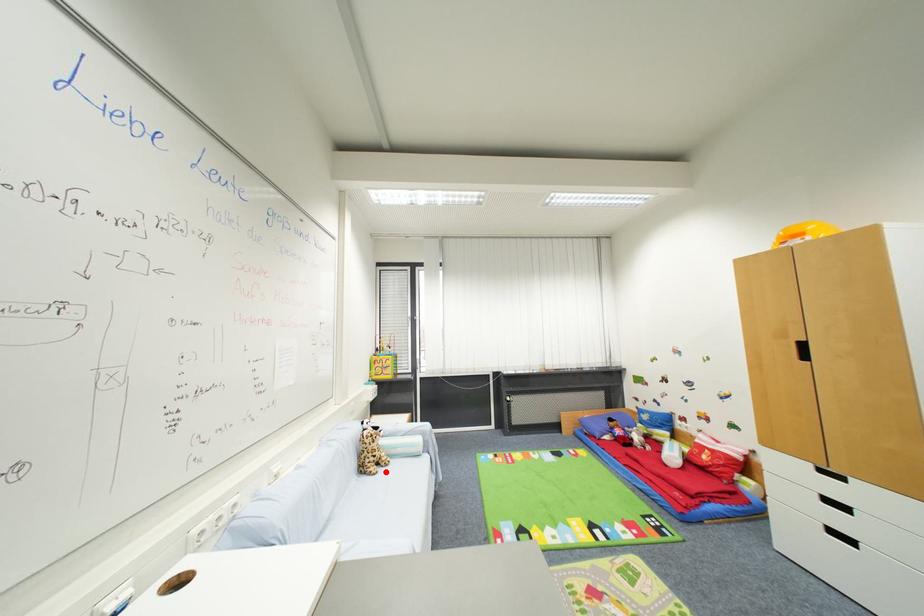
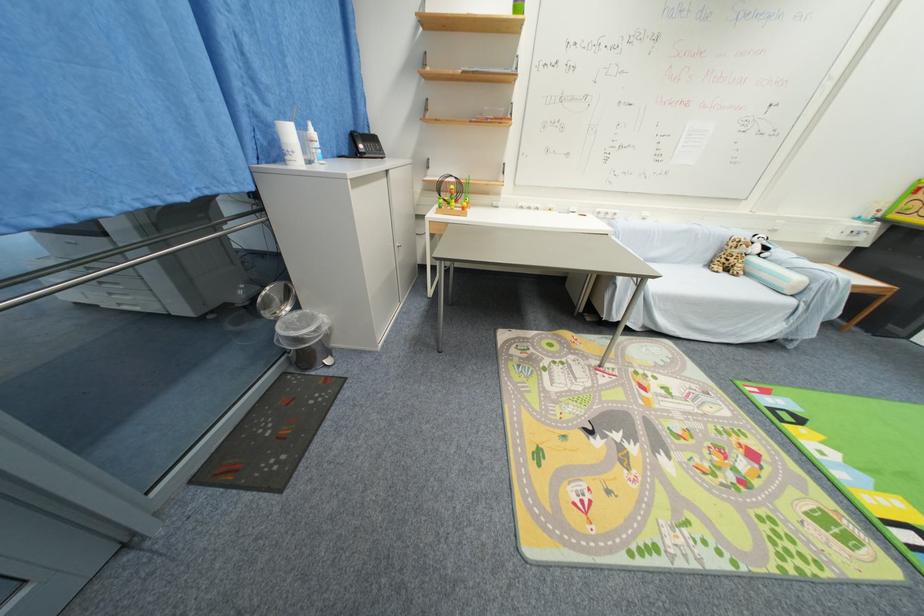
Question: I am providing you with two images of the same scene from different viewpoints. A red point is shown in image1. For the corresponding object point in image2, is it positioned nearer or farther from the camera?

Choices:
 (A) Nearer
 (B) Farther

Answer: (A)